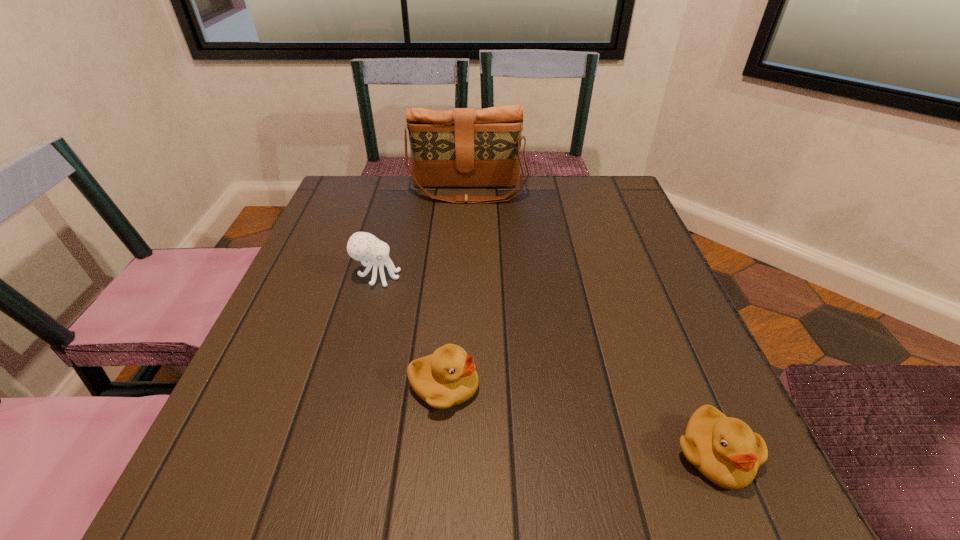
Identify the location of vacant space at the far left corner of the desktop. This screenshot has width=960, height=540. (373, 187).

Where is `vacant space at the far right corner`? The height and width of the screenshot is (540, 960). vacant space at the far right corner is located at coordinates (623, 207).

This screenshot has height=540, width=960. What are the coordinates of `free location at the near right corner of the desktop` in the screenshot? It's located at (696, 518).

The height and width of the screenshot is (540, 960). I want to click on vacant region between the third nearest object and the right duckling, so click(545, 365).

Find the location of a particular element. free space between the shoulder bag and the second tallest object is located at coordinates (422, 234).

Where is `free space between the left duckling and the second tallest object`? The width and height of the screenshot is (960, 540). free space between the left duckling and the second tallest object is located at coordinates (411, 331).

Locate an element on the screen. free space between the second farthest object and the farthest object is located at coordinates (422, 234).

In order to click on vacant space that's between the second farthest object and the nearer duckling in this screenshot , I will do (x=545, y=365).

The width and height of the screenshot is (960, 540). In order to click on free space between the nearer duckling and the shoulder bag in this screenshot , I will do `click(591, 323)`.

Locate an element on the screen. Image resolution: width=960 pixels, height=540 pixels. free spot between the farthest object and the nearest object is located at coordinates (591, 323).